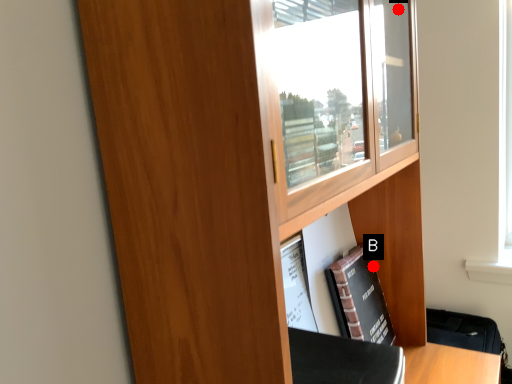
Question: Two points are circled on the image, labeled by A and B beside each circle. Which point appears closest to the camera in this image?

Choices:
 (A) A is closer
 (B) B is closer

Answer: (A)